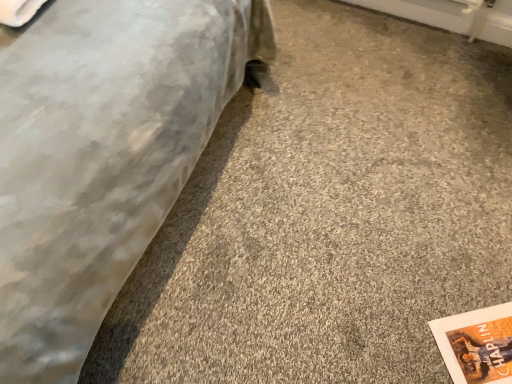
You are a GUI agent. You are given a task and a screenshot of the screen. Output one action in this format:
    pyautogui.click(x=<x>, y=<y>)
    Task: Click on the blank space above orange paper book at lower right (from a real-world perspective)
    The image size is (512, 384).
    Given the screenshot: What is the action you would take?
    pyautogui.click(x=481, y=341)